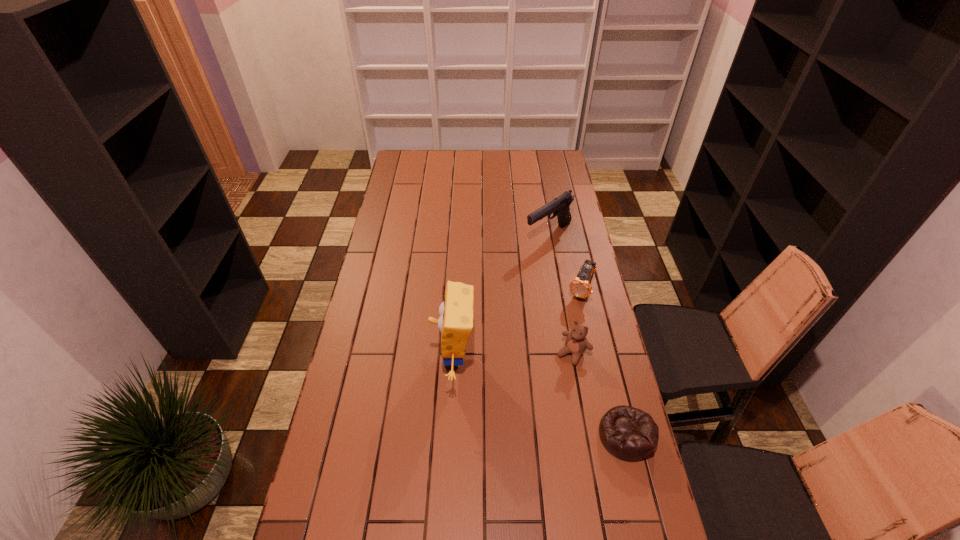
The height and width of the screenshot is (540, 960). Identify the location of blank space located 0.260m on the front-facing side of the teddy bear. (521, 422).

Image resolution: width=960 pixels, height=540 pixels. What are the coordinates of `beanbag located in the right edge section of the desktop` in the screenshot? It's located at (630, 434).

Locate an element on the screen. The image size is (960, 540). gun present at the right edge is located at coordinates (559, 207).

Locate an element on the screen. The width and height of the screenshot is (960, 540). watch that is at the right edge is located at coordinates (580, 286).

Locate an element on the screen. Image resolution: width=960 pixels, height=540 pixels. teddy bear that is at the right edge is located at coordinates (576, 343).

You are a GUI agent. You are given a task and a screenshot of the screen. Output one action in this format:
    pyautogui.click(x=<x>, y=<y>)
    Task: Click on the vacant space at the far edge of the desktop
    
    Given the screenshot: What is the action you would take?
    pyautogui.click(x=449, y=161)

Where is `vacant space at the near edge`? This screenshot has height=540, width=960. vacant space at the near edge is located at coordinates (468, 507).

In the image, there is a desktop. In order to click on vacant space at the left edge in this screenshot , I will do `click(387, 388)`.

This screenshot has height=540, width=960. I want to click on blank space at the right edge of the desktop, so click(x=574, y=204).

Where is `free region at the far left corner of the desktop`? Image resolution: width=960 pixels, height=540 pixels. free region at the far left corner of the desktop is located at coordinates (x=418, y=157).